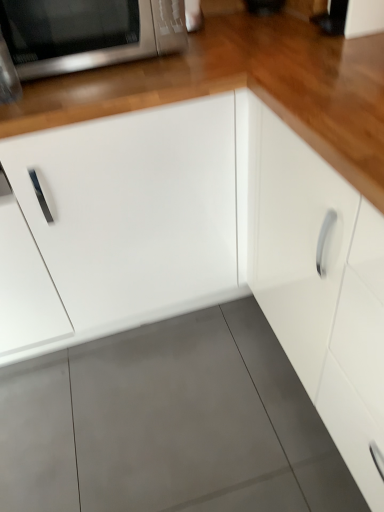
The image size is (384, 512). What do you see at coordinates (315, 280) in the screenshot?
I see `white glossy cabinet at center, the 1th cabinetry from the right` at bounding box center [315, 280].

Based on the photo, what is the approximate height of white matte cabinet at center, the second cabinetry viewed from the right?

white matte cabinet at center, the second cabinetry viewed from the right, is 35.83 inches tall.

Image resolution: width=384 pixels, height=512 pixels. What are the coordinates of `satin silver microwave at upper left` in the screenshot? It's located at (88, 33).

Does point (57, 7) lie in front of point (27, 170)?

Yes.

Is satin silver microwave at upper left looking in the opposite direction of white matte cabinet at center, which is counted as the 1th cabinetry, starting from the left?

No, white matte cabinet at center, which is counted as the 1th cabinetry, starting from the left, is not at the back of satin silver microwave at upper left.

Does satin silver microwave at upper left have a larger size compared to white matte cabinet at center, the second cabinetry viewed from the right?

Incorrect, satin silver microwave at upper left is not larger than white matte cabinet at center, the second cabinetry viewed from the right.

Is satin silver microwave at upper left aimed at white glossy cabinet at center, positioned as the second cabinetry in left-to-right order?

No, satin silver microwave at upper left is not aimed at white glossy cabinet at center, positioned as the second cabinetry in left-to-right order.

Which point is more distant from viewer, (86, 44) or (299, 347)?

Positioned behind is point (299, 347).

Which of these two, satin silver microwave at upper left or white glossy cabinet at center, positioned as the second cabinetry in left-to-right order, is smaller?

With smaller size is satin silver microwave at upper left.

The height and width of the screenshot is (512, 384). Identify the location of microwave oven above the white glossy cabinet at center, positioned as the second cabinetry in left-to-right order (from the image's perspective). (88, 33).

Is white glossy cabinet at center, positioned as the second cabinetry in left-to-right order, not within satin silver microwave at upper left?

white glossy cabinet at center, positioned as the second cabinetry in left-to-right order, lies outside satin silver microwave at upper left's area.

Is point (315, 375) closer to viewer compared to point (96, 27)?

No, (315, 375) is behind (96, 27).

From a real-world perspective, is white glossy cabinet at center, positioned as the second cabinetry in left-to-right order, beneath satin silver microwave at upper left?

Yes, from a real-world perspective, white glossy cabinet at center, positioned as the second cabinetry in left-to-right order, is beneath satin silver microwave at upper left.

Considering the sizes of objects white glossy cabinet at center, the 1th cabinetry from the right, and satin silver microwave at upper left in the image provided, who is wider, white glossy cabinet at center, the 1th cabinetry from the right, or satin silver microwave at upper left?

white glossy cabinet at center, the 1th cabinetry from the right, is wider.

Is white glossy cabinet at center, the 1th cabinetry from the right, bigger or smaller than white matte cabinet at center, the second cabinetry viewed from the right?

Considering their sizes, white glossy cabinet at center, the 1th cabinetry from the right, takes up more space than white matte cabinet at center, the second cabinetry viewed from the right.

Is the depth of white glossy cabinet at center, positioned as the second cabinetry in left-to-right order, greater than that of white matte cabinet at center, which is counted as the 1th cabinetry, starting from the left?

No, white glossy cabinet at center, positioned as the second cabinetry in left-to-right order, is closer to the camera.

Is white glossy cabinet at center, positioned as the second cabinetry in left-to-right order, far away from white matte cabinet at center, the second cabinetry viewed from the right?

No, white glossy cabinet at center, positioned as the second cabinetry in left-to-right order, is not far from white matte cabinet at center, the second cabinetry viewed from the right.

From the image's perspective, is white glossy cabinet at center, the 1th cabinetry from the right, located above or below white matte cabinet at center, the second cabinetry viewed from the right?

white glossy cabinet at center, the 1th cabinetry from the right, is situated lower than white matte cabinet at center, the second cabinetry viewed from the right, in the image.

You are a GUI agent. You are given a task and a screenshot of the screen. Output one action in this format:
    pyautogui.click(x=<x>, y=<y>)
    Task: Click on the cabinetry behind the white glossy cabinet at center, positioned as the second cabinetry in left-to-right order
    The width and height of the screenshot is (384, 512).
    Given the screenshot: What is the action you would take?
    pyautogui.click(x=118, y=225)

Is white matte cabinet at center, which is counted as the 1th cabinetry, starting from the left, situated inside white glossy cabinet at center, positioned as the second cabinetry in left-to-right order, or outside?

white matte cabinet at center, which is counted as the 1th cabinetry, starting from the left, is spatially situated outside white glossy cabinet at center, positioned as the second cabinetry in left-to-right order.

Measure the distance between white matte cabinet at center, the second cabinetry viewed from the right, and white glossy cabinet at center, the 1th cabinetry from the right.

white matte cabinet at center, the second cabinetry viewed from the right, is 14.48 inches away from white glossy cabinet at center, the 1th cabinetry from the right.

Which object is thinner, white matte cabinet at center, which is counted as the 1th cabinetry, starting from the left, or white glossy cabinet at center, positioned as the second cabinetry in left-to-right order?

white glossy cabinet at center, positioned as the second cabinetry in left-to-right order.

Based on the photo, from a real-world perspective, is white matte cabinet at center, the second cabinetry viewed from the right, below satin silver microwave at upper left?

Indeed, from a real-world perspective, white matte cabinet at center, the second cabinetry viewed from the right, is positioned beneath satin silver microwave at upper left.

Which of these two, white matte cabinet at center, which is counted as the 1th cabinetry, starting from the left, or satin silver microwave at upper left, stands shorter?

Standing shorter between the two is satin silver microwave at upper left.

Based on their sizes in the image, would you say white matte cabinet at center, which is counted as the 1th cabinetry, starting from the left, is bigger or smaller than satin silver microwave at upper left?

In the image, white matte cabinet at center, which is counted as the 1th cabinetry, starting from the left, appears to be larger than satin silver microwave at upper left.

Identify the location of microwave oven above the white matte cabinet at center, the second cabinetry viewed from the right (from the image's perspective). The width and height of the screenshot is (384, 512). (88, 33).

You are a GUI agent. You are given a task and a screenshot of the screen. Output one action in this format:
    pyautogui.click(x=<x>, y=<y>)
    Task: Click on the microwave oven located on the left of white matte cabinet at center, the second cabinetry viewed from the right
    This screenshot has width=384, height=512.
    Given the screenshot: What is the action you would take?
    pyautogui.click(x=88, y=33)

From the satin silver microwave at upper left, count 2nd cabinetry to the right and point to it. Please provide its 2D coordinates.

[(315, 280)]

Looking at the image, which one is located closer to white matte cabinet at center, which is counted as the 1th cabinetry, starting from the left, satin silver microwave at upper left or white glossy cabinet at center, positioned as the second cabinetry in left-to-right order?

white glossy cabinet at center, positioned as the second cabinetry in left-to-right order, is closer to white matte cabinet at center, which is counted as the 1th cabinetry, starting from the left.

From the picture: Based on their spatial positions, is white glossy cabinet at center, positioned as the second cabinetry in left-to-right order, or satin silver microwave at upper left closer to white matte cabinet at center, which is counted as the 1th cabinetry, starting from the left?

white glossy cabinet at center, positioned as the second cabinetry in left-to-right order, is closer to white matte cabinet at center, which is counted as the 1th cabinetry, starting from the left.

Considering their positions, is white matte cabinet at center, which is counted as the 1th cabinetry, starting from the left, positioned further to white glossy cabinet at center, positioned as the second cabinetry in left-to-right order, than satin silver microwave at upper left?

satin silver microwave at upper left is positioned further to the anchor white glossy cabinet at center, positioned as the second cabinetry in left-to-right order.

Based on their spatial positions, is white matte cabinet at center, the second cabinetry viewed from the right, or white glossy cabinet at center, the 1th cabinetry from the right, further from satin silver microwave at upper left?

white glossy cabinet at center, the 1th cabinetry from the right, is further to satin silver microwave at upper left.

Based on their spatial positions, is white glossy cabinet at center, the 1th cabinetry from the right, or white matte cabinet at center, which is counted as the 1th cabinetry, starting from the left, closer to satin silver microwave at upper left?

A: The object closer to satin silver microwave at upper left is white matte cabinet at center, which is counted as the 1th cabinetry, starting from the left.

Based on their spatial positions, is satin silver microwave at upper left or white matte cabinet at center, the second cabinetry viewed from the right, closer to white glossy cabinet at center, the 1th cabinetry from the right?

white matte cabinet at center, the second cabinetry viewed from the right, is closer to white glossy cabinet at center, the 1th cabinetry from the right.

Locate an element on the screen. The width and height of the screenshot is (384, 512). cabinetry between satin silver microwave at upper left and white glossy cabinet at center, the 1th cabinetry from the right, in the horizontal direction is located at coordinates (118, 225).